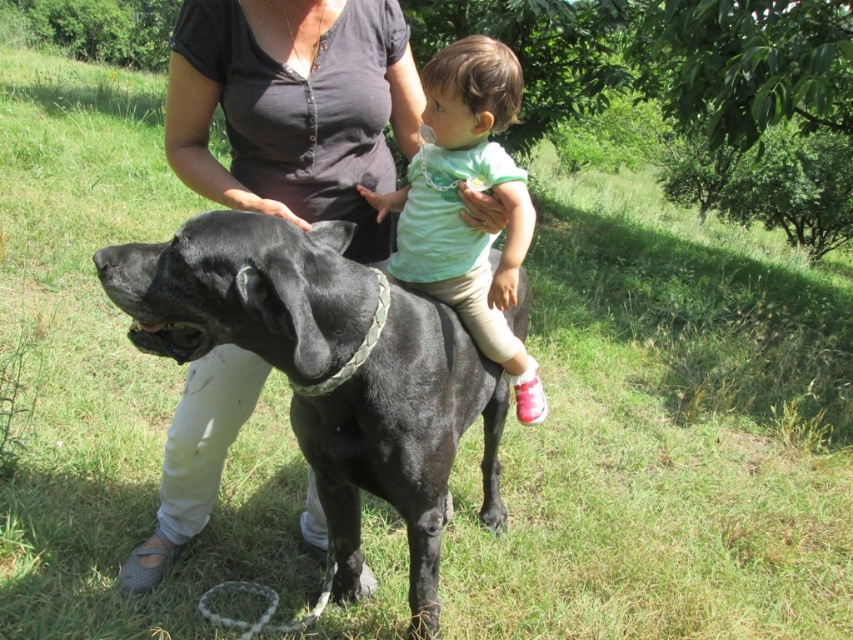
Between shiny black dog at center and light green fabric shirt at center, which one is positioned higher?

light green fabric shirt at center

Where is `shiny black dog at center`? shiny black dog at center is located at coordinates (403, 440).

Between point (251, 300) and point (195, 189), which one is positioned behind?

The point (195, 189) is behind.

Is shiny black dog at center to the right of matte black shirt at center from the viewer's perspective?

Yes, shiny black dog at center is to the right of matte black shirt at center.

Locate an element on the screen. shiny black dog at center is located at coordinates (403, 440).

Is point (328, 116) more distant than point (497, 355)?

No, (328, 116) is in front of (497, 355).

Which is below, matte black shirt at center or light green fabric shirt at center?

light green fabric shirt at center

Image resolution: width=853 pixels, height=640 pixels. I want to click on matte black shirt at center, so click(294, 108).

The width and height of the screenshot is (853, 640). In order to click on matte black shirt at center in this screenshot , I will do `click(294, 108)`.